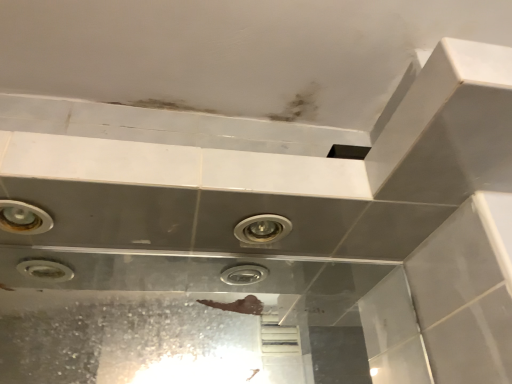
Question: Can you confirm if matte silver light fixture at center is taller than matte silver light fixture at upper left?

Choices:
 (A) yes
 (B) no

Answer: (A)

Question: Considering the relative sizes of matte silver light fixture at center and matte silver light fixture at upper left in the image provided, is matte silver light fixture at center wider than matte silver light fixture at upper left?

Choices:
 (A) yes
 (B) no

Answer: (B)

Question: From a real-world perspective, is matte silver light fixture at center over matte silver light fixture at upper left?

Choices:
 (A) yes
 (B) no

Answer: (A)

Question: Does matte silver light fixture at center appear on the right side of matte silver light fixture at upper left?

Choices:
 (A) yes
 (B) no

Answer: (A)

Question: Considering the relative positions of matte silver light fixture at center and matte silver light fixture at upper left in the image provided, is matte silver light fixture at center in front of matte silver light fixture at upper left?

Choices:
 (A) no
 (B) yes

Answer: (A)

Question: Is matte silver light fixture at center far away from matte silver light fixture at upper left?

Choices:
 (A) no
 (B) yes

Answer: (A)

Question: Is matte silver light fixture at center located within matte silver light fixture at upper left?

Choices:
 (A) no
 (B) yes

Answer: (A)

Question: Is matte silver light fixture at upper left positioned far away from matte silver light fixture at center?

Choices:
 (A) no
 (B) yes

Answer: (A)

Question: From the image's perspective, is matte silver light fixture at upper left above matte silver light fixture at center?

Choices:
 (A) no
 (B) yes

Answer: (B)

Question: Could you tell me if matte silver light fixture at upper left is turned towards matte silver light fixture at center?

Choices:
 (A) no
 (B) yes

Answer: (A)

Question: Is the depth of matte silver light fixture at upper left greater than that of matte silver light fixture at center?

Choices:
 (A) yes
 (B) no

Answer: (B)

Question: From the image's perspective, is matte silver light fixture at upper left located beneath matte silver light fixture at center?

Choices:
 (A) no
 (B) yes

Answer: (A)

Question: Do you think matte silver light fixture at center is within matte silver light fixture at upper left, or outside of it?

Choices:
 (A) inside
 (B) outside

Answer: (B)